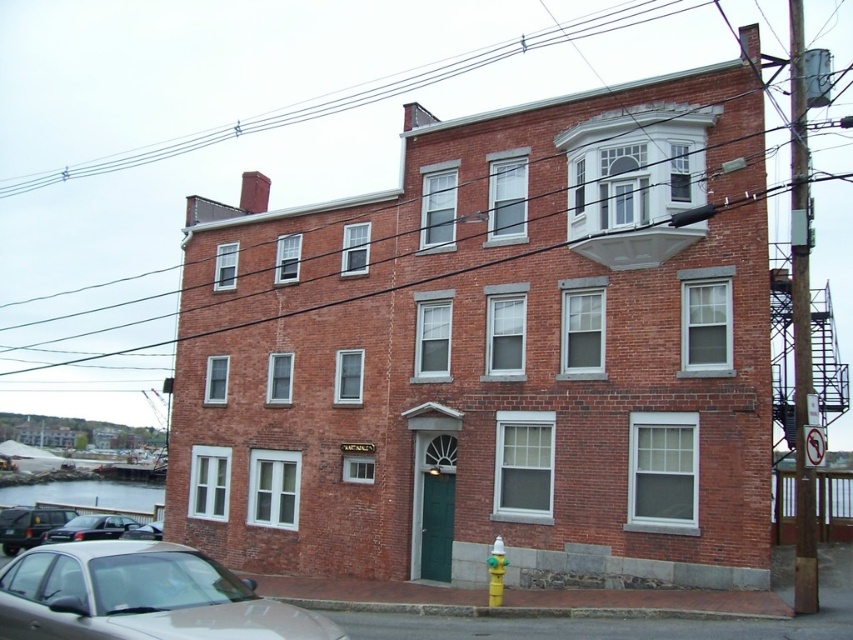
You are driving a car that is 4 meters long. You want to park between the shiny black car at lower left and the black glossy car at lower left. Is there enough space to park your car between them?

The shiny black car at lower left and the black glossy car at lower left are 3.62 meters apart. Since your car is 4 meters long, there isn not enough space to park between them.

You are a delivery driver who needs to park your vehicle between the black glossy car at lower left and the yellow matte hydrant at lower right. Can you fit your truck, which is 2 meters wide, in the available space between them?

The black glossy car at lower left is positioned on the left side of yellow matte hydrant at lower right, but the exact distance between them isn